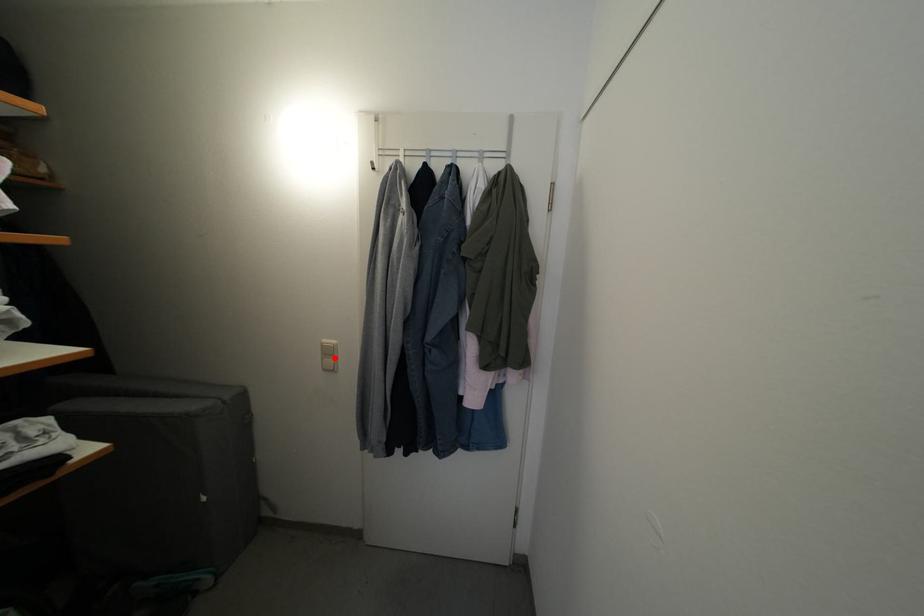
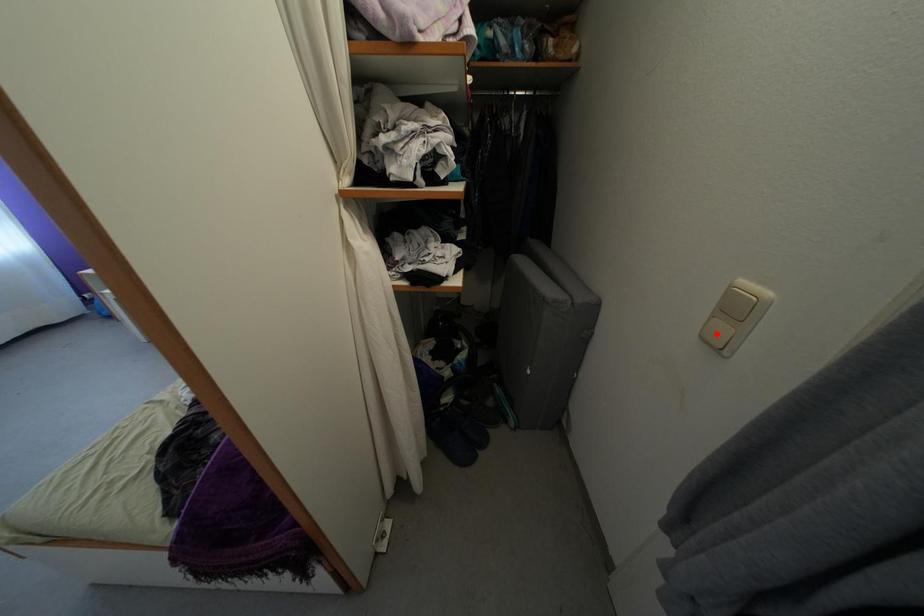
I am providing you with two images of the same scene from different viewpoints. A red point is marked on the first image and another point is marked on the second image. Does the point marked in image1 correspond to the same location as the one in image2?

No